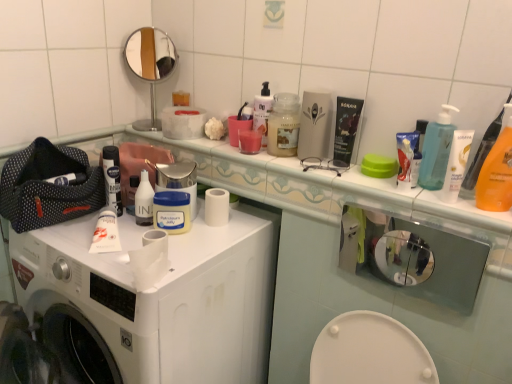
The width and height of the screenshot is (512, 384). In order to click on vacant space that is to the left of orange plastic bottle at right in this screenshot , I will do (x=436, y=209).